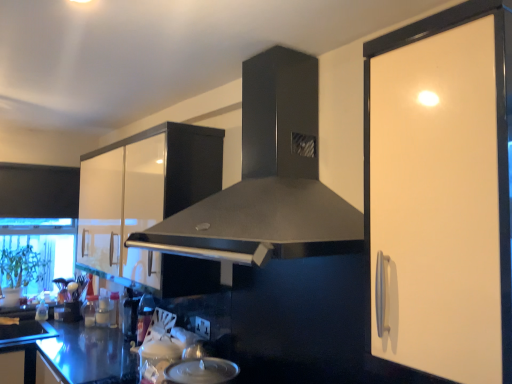
Question: Should I look upward or downward to see matte black range hood at center?

Choices:
 (A) down
 (B) up

Answer: (B)

Question: Is shiny metallic bottle at lower left, the 1th appliance in the right-to-left sequence, positioned behind glossy white cabinet at upper left?

Choices:
 (A) yes
 (B) no

Answer: (A)

Question: From the image's perspective, is shiny metallic bottle at lower left, which is the first appliance in front-to-back order, under glossy white cabinet at upper left?

Choices:
 (A) no
 (B) yes

Answer: (B)

Question: Is shiny metallic bottle at lower left, which is the 2th appliance from left to right, taller than glossy white cabinet at upper left?

Choices:
 (A) no
 (B) yes

Answer: (A)

Question: From the image's perspective, is shiny metallic bottle at lower left, which is the 2th appliance from left to right, over glossy white cabinet at upper left?

Choices:
 (A) yes
 (B) no

Answer: (B)

Question: From a real-world perspective, does shiny metallic bottle at lower left, the 1th appliance in the right-to-left sequence, stand above glossy white cabinet at upper left?

Choices:
 (A) no
 (B) yes

Answer: (A)

Question: From a real-world perspective, does shiny metallic bottle at lower left, which is the 2th appliance from left to right, sit lower than glossy white cabinet at upper left?

Choices:
 (A) yes
 (B) no

Answer: (A)

Question: Is matte black knife block at lower left, arranged as the 1th appliance when viewed from the back, taller than glossy white cabinet at upper left?

Choices:
 (A) no
 (B) yes

Answer: (A)

Question: Is matte black knife block at lower left, arranged as the first appliance when viewed from the left, smaller than glossy white cabinet at upper left?

Choices:
 (A) no
 (B) yes

Answer: (B)

Question: Would you consider matte black knife block at lower left, arranged as the 1th appliance when viewed from the back, to be distant from glossy white cabinet at upper left?

Choices:
 (A) yes
 (B) no

Answer: (A)

Question: From the image's perspective, is matte black knife block at lower left, arranged as the first appliance when viewed from the left, located beneath glossy white cabinet at upper left?

Choices:
 (A) no
 (B) yes

Answer: (B)

Question: Considering the relative sizes of matte black knife block at lower left, arranged as the 1th appliance when viewed from the back, and glossy white cabinet at upper left in the image provided, is matte black knife block at lower left, arranged as the 1th appliance when viewed from the back, bigger than glossy white cabinet at upper left?

Choices:
 (A) yes
 (B) no

Answer: (B)

Question: Is the depth of matte black knife block at lower left, arranged as the first appliance when viewed from the left, greater than that of glossy white cabinet at upper left?

Choices:
 (A) no
 (B) yes

Answer: (B)

Question: Is transparent glass window screen at lower left at the right side of shiny metallic bottle at lower left, the 1th appliance in the right-to-left sequence?

Choices:
 (A) yes
 (B) no

Answer: (B)